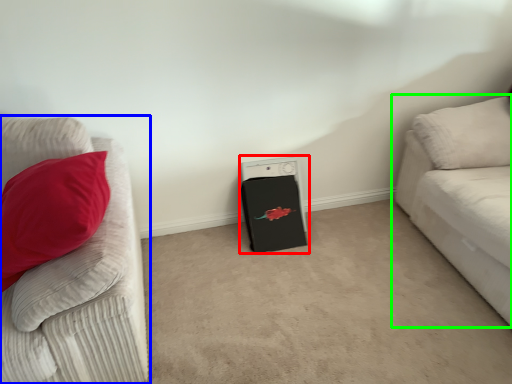
Question: Which object is positioned closest to appliance (highlighted by a red box)? Select from studio couch (highlighted by a blue box) and studio couch (highlighted by a green box).

Choices:
 (A) studio couch
 (B) studio couch

Answer: (B)